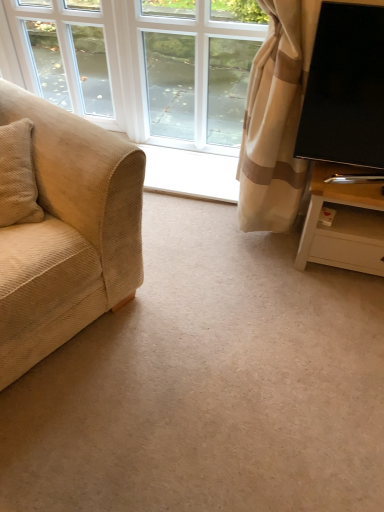
Question: Would you say white wood tv stand at right is outside white glass window at center, the 1th window viewed from the right?

Choices:
 (A) no
 (B) yes

Answer: (B)

Question: Considering the relative sizes of white wood tv stand at right and white glass window at center, the 2th window positioned from the left, in the image provided, is white wood tv stand at right wider than white glass window at center, the 2th window positioned from the left,?

Choices:
 (A) no
 (B) yes

Answer: (B)

Question: Would you say white wood tv stand at right contains white glass window at center, the 1th window viewed from the right?

Choices:
 (A) yes
 (B) no

Answer: (B)

Question: From a real-world perspective, is white wood tv stand at right over white glass window at center, the 1th window viewed from the right?

Choices:
 (A) yes
 (B) no

Answer: (B)

Question: Does white wood tv stand at right turn towards white glass window at center, the 1th window viewed from the right?

Choices:
 (A) yes
 (B) no

Answer: (B)

Question: Choose the correct answer: Is white glass window at upper left, positioned as the first window in left-to-right order, inside white wood tv stand at right or outside it?

Choices:
 (A) outside
 (B) inside

Answer: (A)

Question: From a real-world perspective, is white glass window at upper left, which is counted as the second window, starting from the right, positioned above or below white wood tv stand at right?

Choices:
 (A) above
 (B) below

Answer: (A)

Question: Is point (61, 55) closer or farther from the camera than point (344, 253)?

Choices:
 (A) farther
 (B) closer

Answer: (A)

Question: Is white glass window at upper left, which is counted as the second window, starting from the right, wider or thinner than white wood tv stand at right?

Choices:
 (A) thin
 (B) wide

Answer: (A)

Question: From their relative heights in the image, would you say white wood tv stand at right is taller or shorter than beige corduroy couch at left?

Choices:
 (A) short
 (B) tall

Answer: (A)

Question: Considering the positions of white wood tv stand at right and beige corduroy couch at left in the image, is white wood tv stand at right bigger or smaller than beige corduroy couch at left?

Choices:
 (A) big
 (B) small

Answer: (B)

Question: In terms of width, does white wood tv stand at right look wider or thinner when compared to beige corduroy couch at left?

Choices:
 (A) wide
 (B) thin

Answer: (B)

Question: Is white wood tv stand at right in front of or behind beige corduroy couch at left in the image?

Choices:
 (A) behind
 (B) front

Answer: (A)

Question: Choose the correct answer: Is beige corduroy couch at left inside white wood tv stand at right or outside it?

Choices:
 (A) outside
 (B) inside

Answer: (A)

Question: From the image's perspective, is beige corduroy couch at left above or below white wood tv stand at right?

Choices:
 (A) below
 (B) above

Answer: (B)